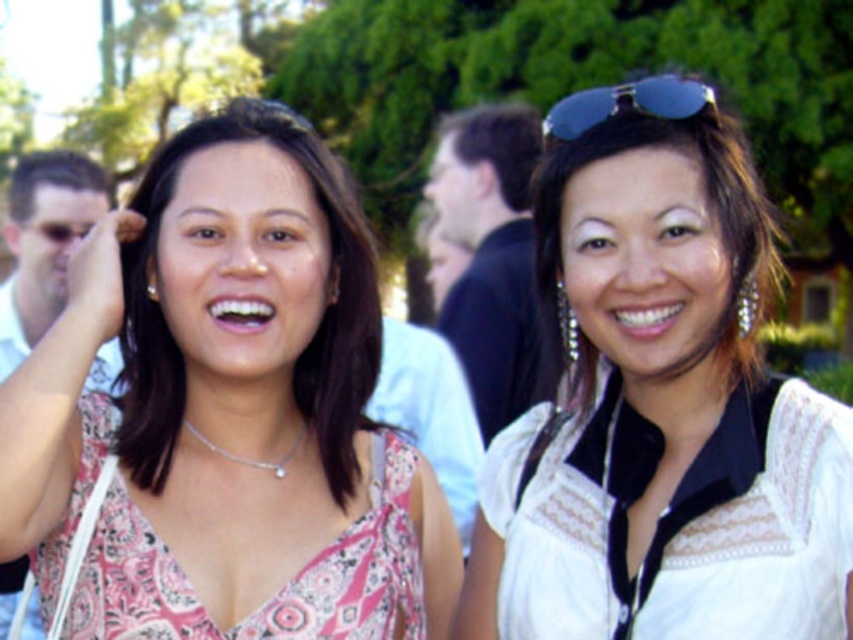
Is white lace blouse at center taller than pink printed dress at center?

Incorrect, white lace blouse at center's height is not larger of pink printed dress at center's.

How far apart are white lace blouse at center and pink printed dress at center?

29.92 inches

Is point (692, 202) closer to camera compared to point (16, 458)?

No, it is not.

At what (x,y) coordinates should I click in order to perform the action: click on white lace blouse at center. Please return your answer as a coordinate pair (x, y). Image resolution: width=853 pixels, height=640 pixels. Looking at the image, I should click on (660, 403).

Does pink printed dress at center have a lesser height compared to pink printed fabric dress at center?

No, pink printed dress at center is not shorter than pink printed fabric dress at center.

Who is more forward, [273,280] or [120,504]?

Point [120,504] is more forward.

Identify the location of pink printed dress at center. This screenshot has height=640, width=853. pyautogui.click(x=218, y=355).

Does pink printed dress at center have a larger size compared to blue reflective sunglasses at upper right?

Correct, pink printed dress at center is larger in size than blue reflective sunglasses at upper right.

Which is behind, point (373, 252) or point (581, 131)?

Point (373, 252)

Between point (357, 260) and point (683, 96), which one is positioned in front?

Positioned in front is point (683, 96).

This screenshot has width=853, height=640. What are the coordinates of `pink printed dress at center` in the screenshot? It's located at (218, 355).